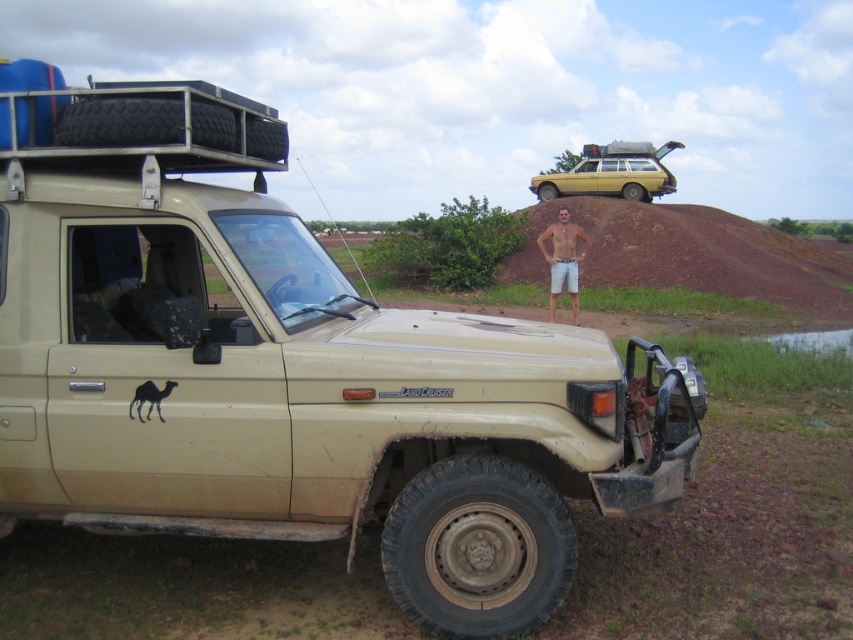
Is yellow matte station wagon at upper center smaller than tan shorts at center?

Incorrect, yellow matte station wagon at upper center is not smaller in size than tan shorts at center.

Can you confirm if yellow matte station wagon at upper center is positioned above tan shorts at center?

Yes.

Identify the location of yellow matte station wagon at upper center. (612, 172).

Find the location of a particular element. yellow matte station wagon at upper center is located at coordinates (612, 172).